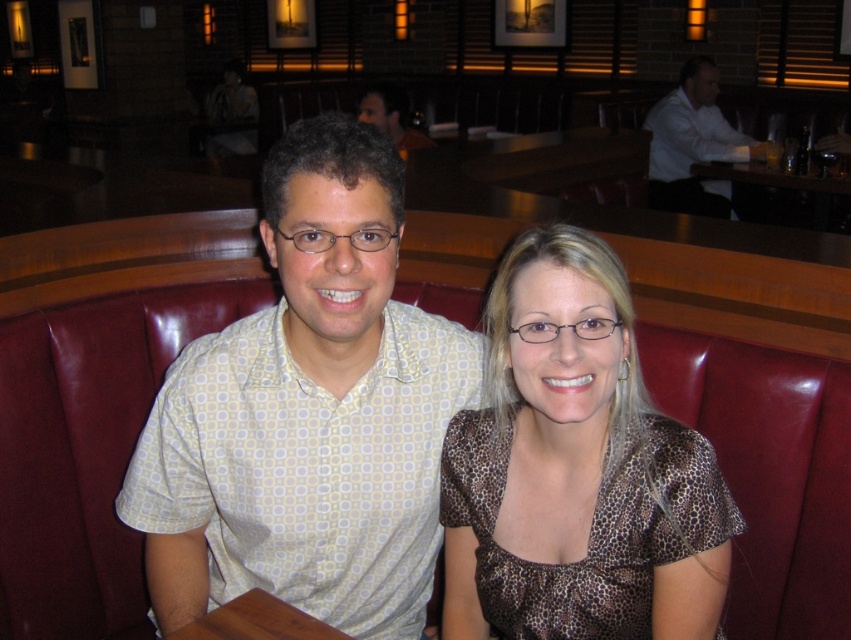
Which is in front, point (650, 449) or point (660, 204)?

Point (650, 449)

Is brown leopard print blouse at center shorter than white shirt at upper right?

Correct, brown leopard print blouse at center is not as tall as white shirt at upper right.

Where is `brown leopard print blouse at center`? Image resolution: width=851 pixels, height=640 pixels. brown leopard print blouse at center is located at coordinates (575, 468).

Where is `brown leopard print blouse at center`? This screenshot has width=851, height=640. brown leopard print blouse at center is located at coordinates (575, 468).

Does white dotted shirt at center have a greater width compared to white shirt at upper right?

No, white dotted shirt at center is not wider than white shirt at upper right.

Consider the image. Is the position of white dotted shirt at center more distant than that of white shirt at upper right?

No.

Does point (227, 438) lie behind point (714, 88)?

No, it is not.

Find the location of a particular element. white dotted shirt at center is located at coordinates (307, 413).

Between white dotted shirt at center and brown leopard print blouse at center, which one is positioned lower?

brown leopard print blouse at center is below.

Describe the element at coordinates (307, 413) in the screenshot. I see `white dotted shirt at center` at that location.

Who is more distant from viewer, (327, 372) or (598, 451)?

Point (327, 372)

Where is `white dotted shirt at center`? This screenshot has height=640, width=851. white dotted shirt at center is located at coordinates point(307,413).